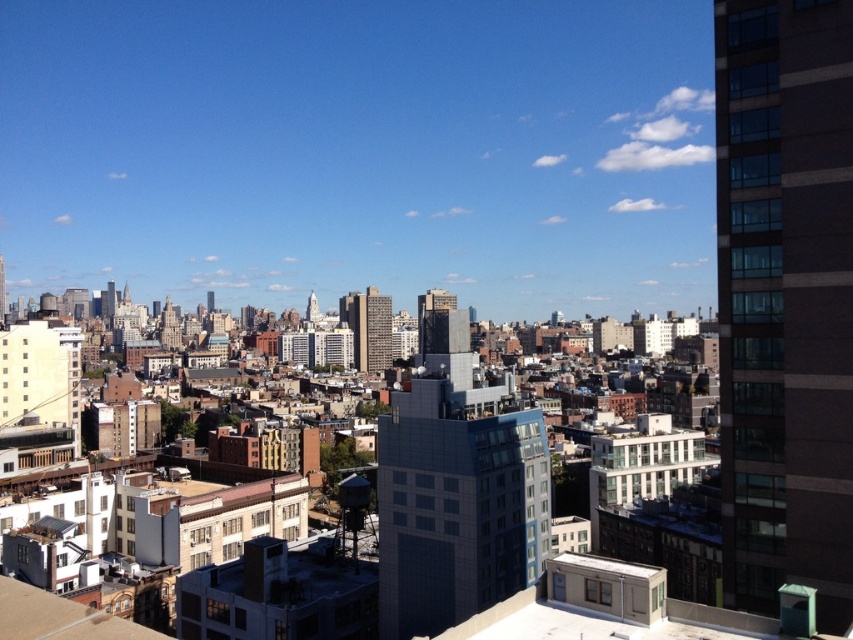
Question: Is glassy reflective building at right smaller than smooth concrete skyscraper at center?

Choices:
 (A) no
 (B) yes

Answer: (A)

Question: Estimate the real-world distances between objects in this image. Which object is closer to the blue glass building at center?

Choices:
 (A) glassy reflective building at right
 (B) smooth concrete skyscraper at center

Answer: (A)

Question: Estimate the real-world distances between objects in this image. Which object is farther from the matte gray building at center?

Choices:
 (A) smooth concrete skyscraper at center
 (B) blue glass building at center
 (C) glassy reflective building at right

Answer: (C)

Question: Which of these objects is positioned closest to the smooth concrete skyscraper at center?

Choices:
 (A) glassy reflective building at right
 (B) blue glass building at center

Answer: (B)

Question: Does glassy reflective building at right have a lesser width compared to smooth concrete skyscraper at center?

Choices:
 (A) no
 (B) yes

Answer: (A)

Question: Is blue glass building at center below smooth concrete skyscraper at center?

Choices:
 (A) yes
 (B) no

Answer: (A)